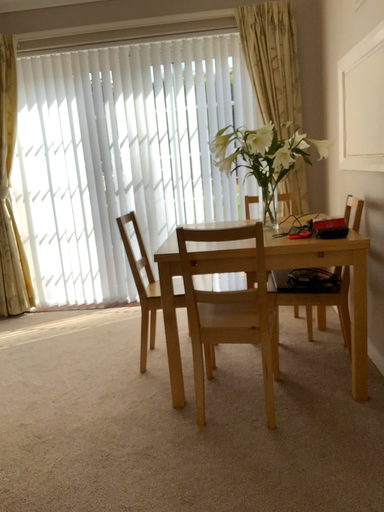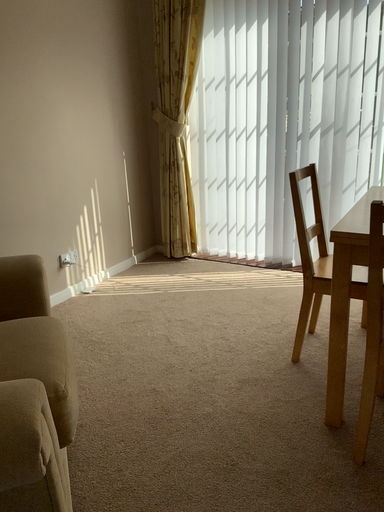
Question: How did the camera likely rotate when shooting the video?

Choices:
 (A) rotated downward
 (B) rotated upward

Answer: (A)